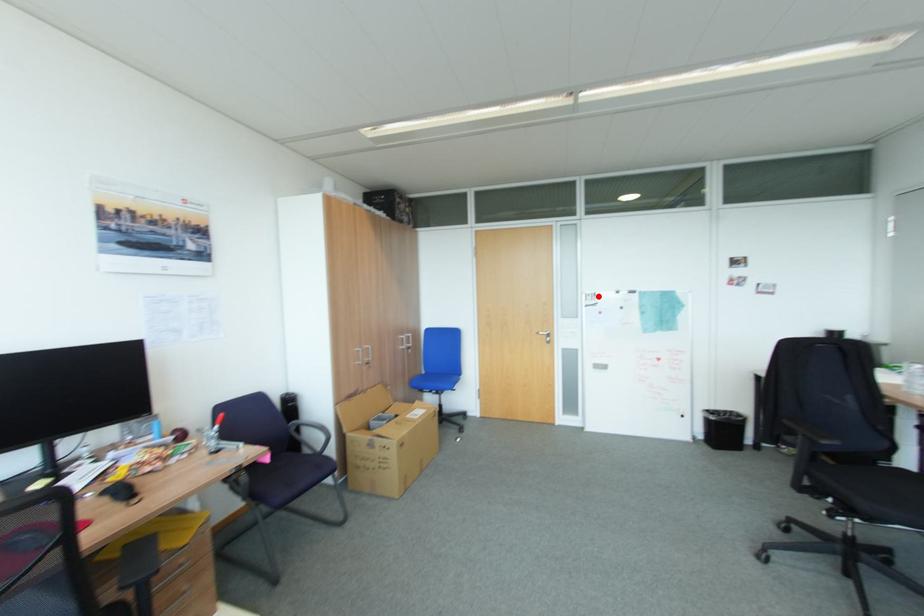
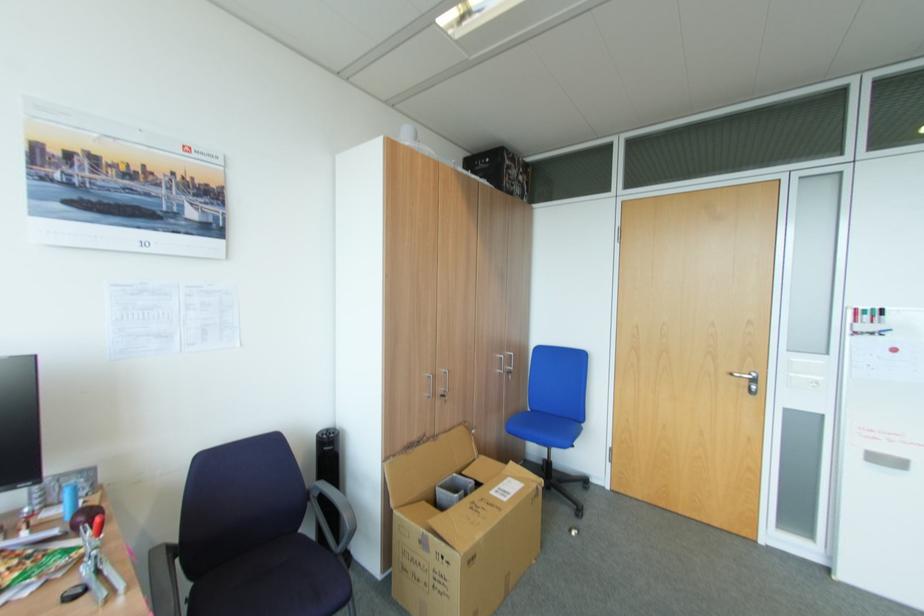
Question: I am providing you with two images of the same scene from different viewpoints. A red point is marked on the first image. Is the red point's position out of view in image 2?

Choices:
 (A) Yes
 (B) No

Answer: (B)